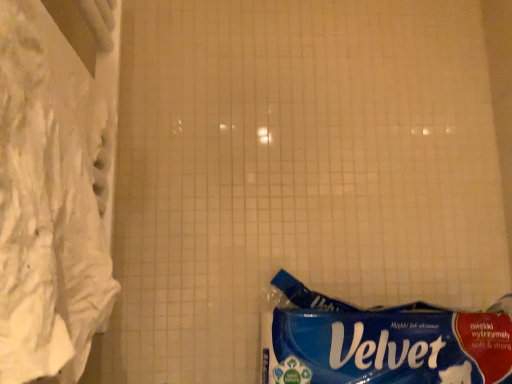
Question: From a real-world perspective, is blue paper towel at lower right positioned above or below white fabric curtain at left?

Choices:
 (A) above
 (B) below

Answer: (B)

Question: Is blue paper towel at lower right wider or thinner than white fabric curtain at left?

Choices:
 (A) wide
 (B) thin

Answer: (A)

Question: Is blue paper towel at lower right situated inside white fabric curtain at left or outside?

Choices:
 (A) outside
 (B) inside

Answer: (A)

Question: Is white fabric curtain at left wider or thinner than blue paper towel at lower right?

Choices:
 (A) thin
 (B) wide

Answer: (A)

Question: In terms of size, does white fabric curtain at left appear bigger or smaller than blue paper towel at lower right?

Choices:
 (A) big
 (B) small

Answer: (B)

Question: In terms of height, does white fabric curtain at left look taller or shorter compared to blue paper towel at lower right?

Choices:
 (A) tall
 (B) short

Answer: (A)

Question: From a real-world perspective, is white fabric curtain at left positioned above or below blue paper towel at lower right?

Choices:
 (A) below
 (B) above

Answer: (B)